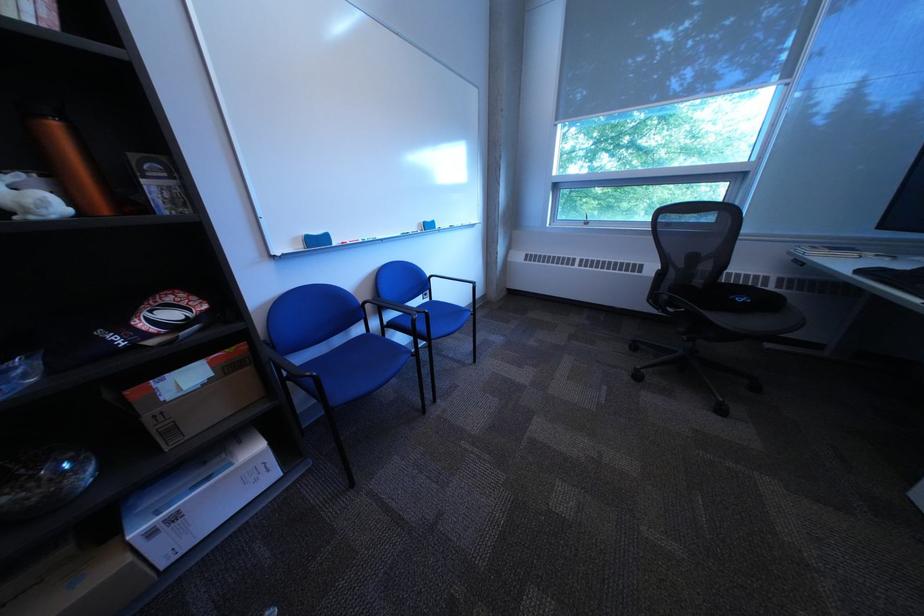
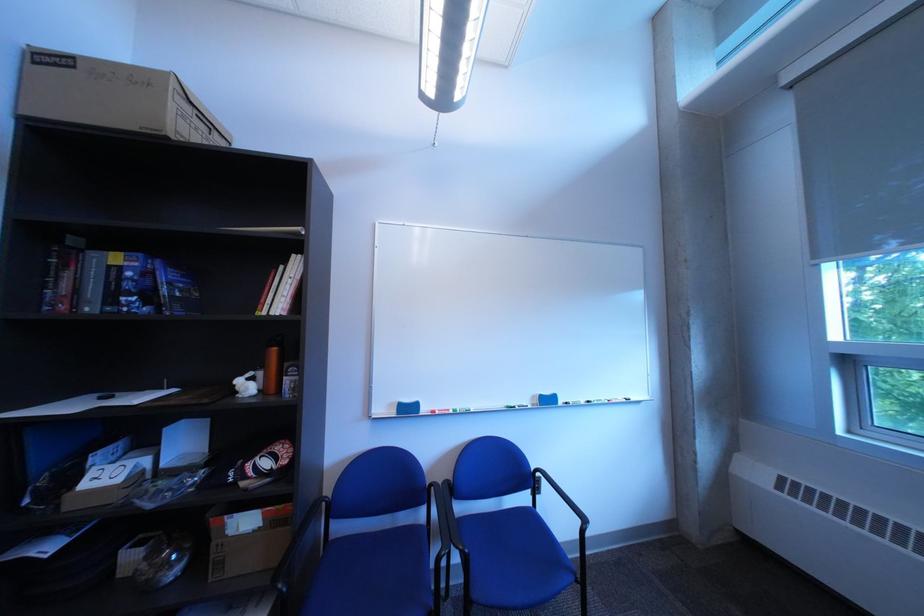
Locate, in the second image, the point that corresponds to point 442,314 in the first image.

(482, 553)